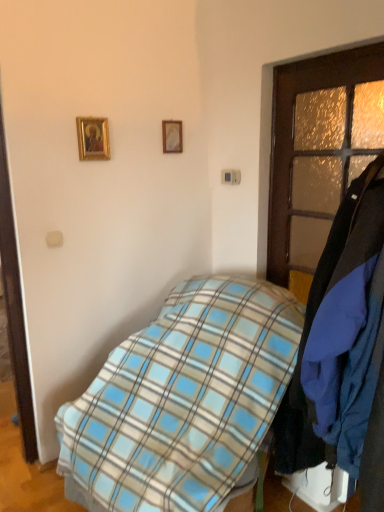
Question: Does brown wooden door at right have a larger size compared to gold-framed picture at upper center, placed as the 1th picture frame when sorted from right to left?

Choices:
 (A) yes
 (B) no

Answer: (A)

Question: Is brown wooden door at right behind gold-framed picture at upper center, the 2th picture frame when ordered from front to back?

Choices:
 (A) yes
 (B) no

Answer: (B)

Question: Is brown wooden door at right positioned far away from gold-framed picture at upper center, the second picture frame when ordered from left to right?

Choices:
 (A) no
 (B) yes

Answer: (A)

Question: From the image's perspective, is brown wooden door at right under gold-framed picture at upper center, the 2th picture frame when ordered from front to back?

Choices:
 (A) no
 (B) yes

Answer: (B)

Question: Is brown wooden door at right closer to the viewer compared to gold-framed picture at upper center, the second picture frame when ordered from left to right?

Choices:
 (A) no
 (B) yes

Answer: (B)

Question: From a real-world perspective, is brown wooden door at right below gold-framed picture at upper center, the second picture frame when ordered from left to right?

Choices:
 (A) yes
 (B) no

Answer: (A)

Question: From a real-world perspective, is brown wooden door at right on gold-framed picture at upper left, the first picture frame in the left-to-right sequence?

Choices:
 (A) yes
 (B) no

Answer: (B)

Question: Does brown wooden door at right appear on the right side of gold-framed picture at upper left, arranged as the 2th picture frame when viewed from the right?

Choices:
 (A) yes
 (B) no

Answer: (A)

Question: Considering the relative sizes of brown wooden door at right and gold-framed picture at upper left, the first picture frame in the left-to-right sequence, in the image provided, is brown wooden door at right taller than gold-framed picture at upper left, the first picture frame in the left-to-right sequence,?

Choices:
 (A) no
 (B) yes

Answer: (B)

Question: Could you tell me if brown wooden door at right is facing gold-framed picture at upper left, the 1th picture frame from the front?

Choices:
 (A) no
 (B) yes

Answer: (A)

Question: Does brown wooden door at right have a lesser height compared to gold-framed picture at upper left, the 1th picture frame from the front?

Choices:
 (A) yes
 (B) no

Answer: (B)

Question: Is brown wooden door at right further to the viewer compared to gold-framed picture at upper left, the 1th picture frame from the front?

Choices:
 (A) yes
 (B) no

Answer: (B)

Question: From the image's perspective, does blue plaid blanket at center appear higher than gold-framed picture at upper center, which is the first picture frame in back-to-front order?

Choices:
 (A) no
 (B) yes

Answer: (A)